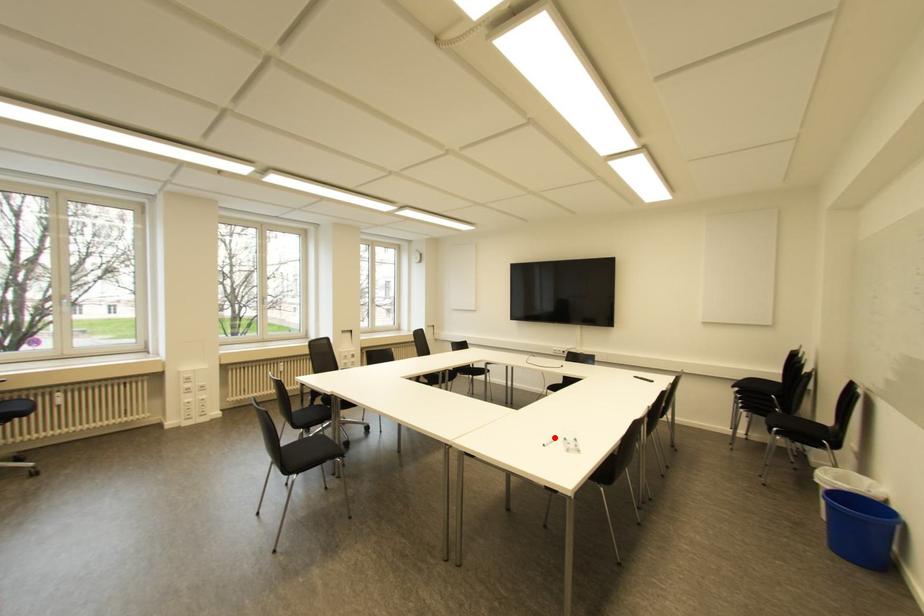
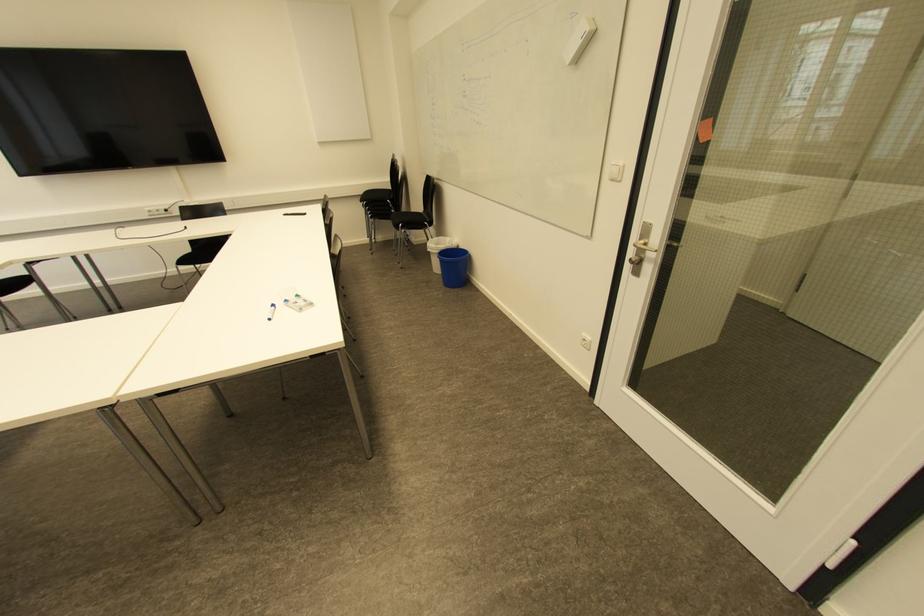
Question: I am providing you with two images of the same scene from different viewpoints. Given a red point in image1, look at the same physical point in image2. Is it:

Choices:
 (A) Closer to the viewpoint
 (B) Farther from the viewpoint

Answer: (B)